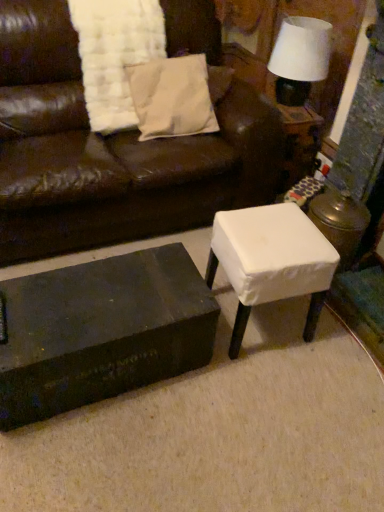
Question: Is matte brown leather couch at center inside or outside of white cotton pillow at upper center?

Choices:
 (A) outside
 (B) inside

Answer: (A)

Question: From the image's perspective, is matte brown leather couch at center positioned above or below white cotton pillow at upper center?

Choices:
 (A) below
 (B) above

Answer: (A)

Question: Considering the real-world distances, which object is farthest from the white fabric stool at center?

Choices:
 (A) white cotton pillow at upper center
 (B) white textured blanket at upper left
 (C) matte brown leather couch at center
 (D) black matte/wooden coffee table at lower left
 (E) white fabric lampshade at upper right

Answer: (E)

Question: Which object is positioned farthest from the white fabric-covered stool at right?

Choices:
 (A) white cotton pillow at upper center
 (B) white textured blanket at upper left
 (C) white fabric lampshade at upper right
 (D) matte brown leather couch at center
 (E) white fabric stool at center

Answer: (B)